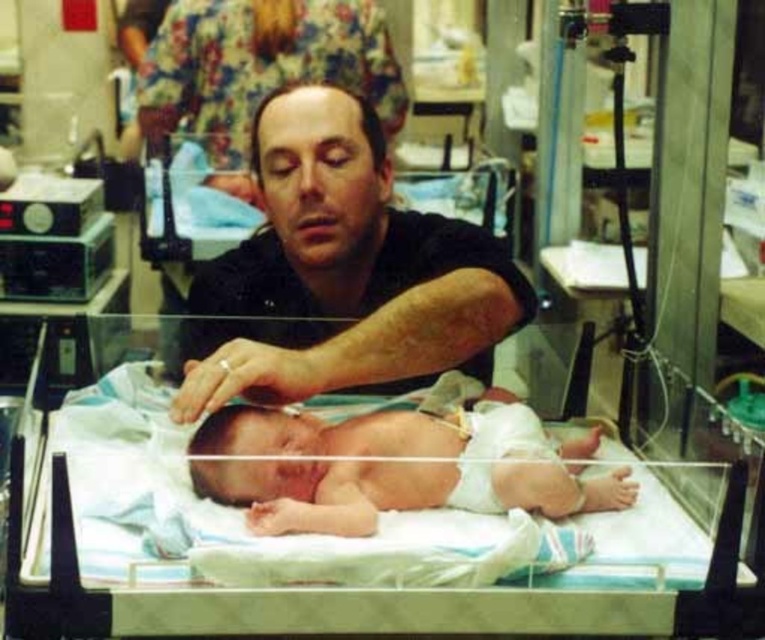
You are a nurse standing at the camera position and need to check the incubator. Is the smooth skin man at center blocking your view of the incubator?

The smooth skin man at center is 1.07 meters from the camera, so he is close enough to potentially block the view of the incubator. You should ask him to move aside or adjust your position to ensure clear access to the incubator for inspection.

You are a nurse in the hospital and need to place a medical kit between the white fabric hospital bed at center and the smooth skin man at center. The medical kit is 10 inches long. Will it fit between them?

The white fabric hospital bed at center and smooth skin man at center are 11.21 inches apart from each other. Since the medical kit is 10 inches long, it will fit between them as there is enough space.